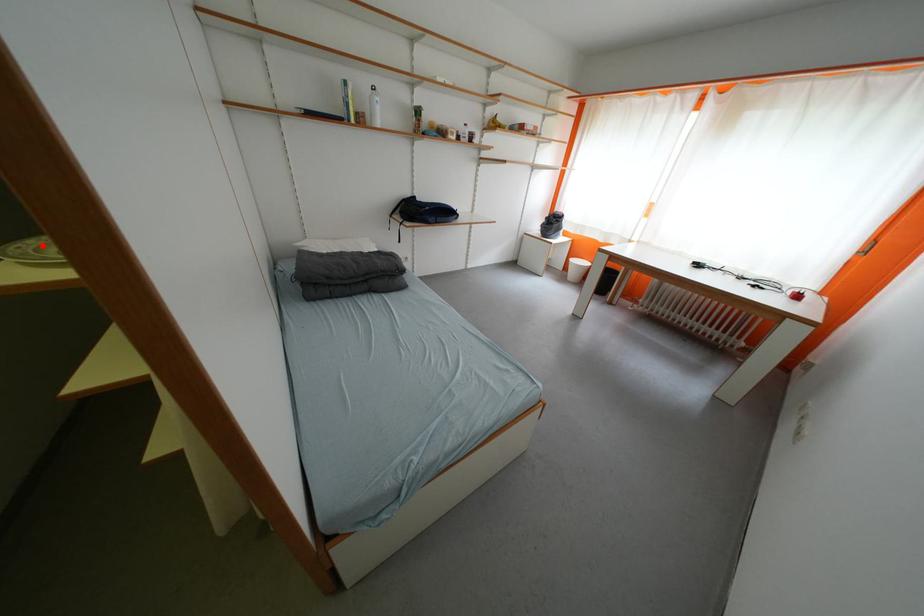
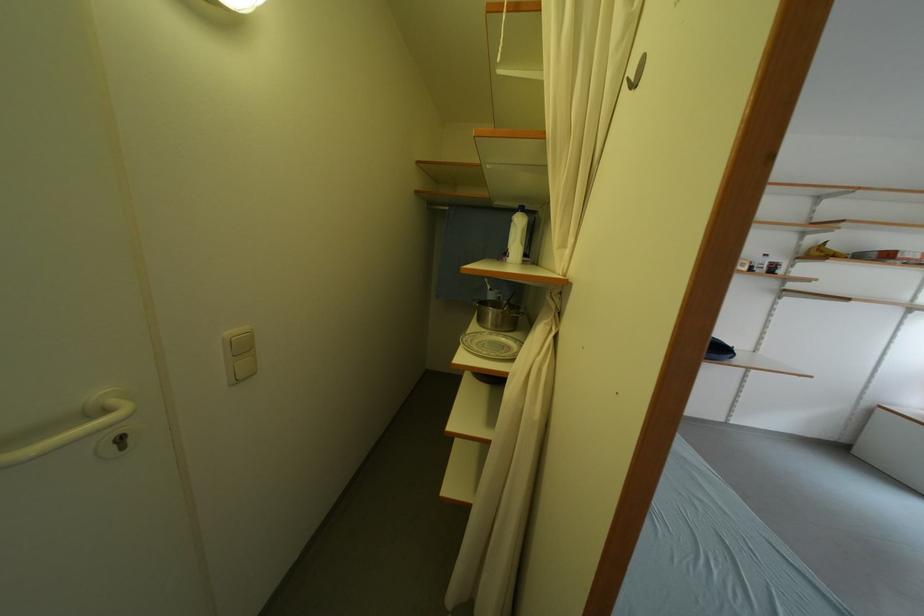
In the second image, find the point that corresponds to the highlighted location in the first image.

(476, 339)